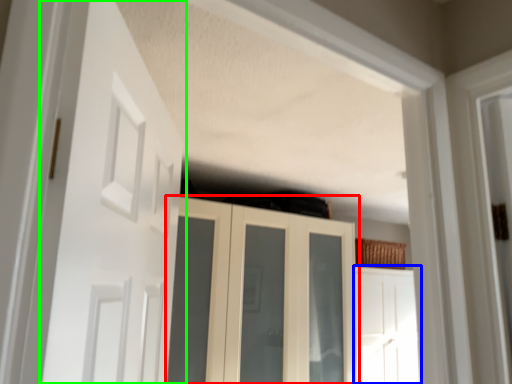
Question: Considering the real-world distances, which object is closest to cupboard (highlighted by a red box)? door (highlighted by a blue box) or door (highlighted by a green box).

Choices:
 (A) door
 (B) door

Answer: (A)